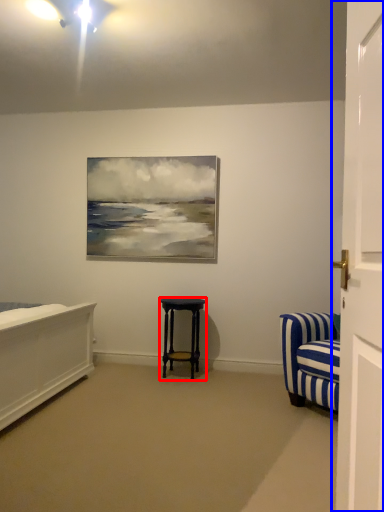
Question: Which object appears closest to the camera in this image, stool (highlighted by a red box) or door (highlighted by a blue box)?

Choices:
 (A) stool
 (B) door

Answer: (B)